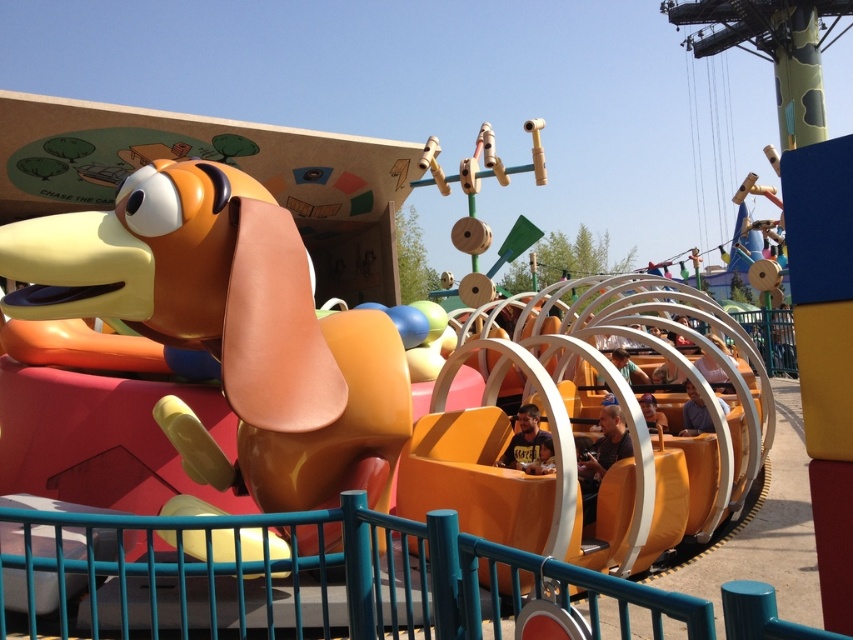
You are standing at the point marked as point (384, 410) and want to reach the entrance of the amusement park ride. The entrance is located at the dog figure. If the distance between you and the entrance is 4.05 meters, can you walk directly to the entrance without any obstacles?

The distance between you and the entrance is 4.05 meters, so yes, you can walk directly to the entrance without any obstacles since there are no mentioned obstacles in the scene description.

You are standing in the amusement park and see the pink fabric person at center. If you want to throw a ball to reach them, and you can throw a ball up to 7 meters, will you be able to reach them?

The pink fabric person at center and the viewer are 6.90 meters apart from each other. Since the viewer can throw a ball up to 7 meters, they can just barely reach the pink fabric person at center with the ball.

You are a stylist observing two clients with different hair types. The first client has matte brown hair at center and the second has smooth brown hair at center. Which client has wider hair?

The matte brown hair at center is wider than the smooth brown hair at center according to the description.